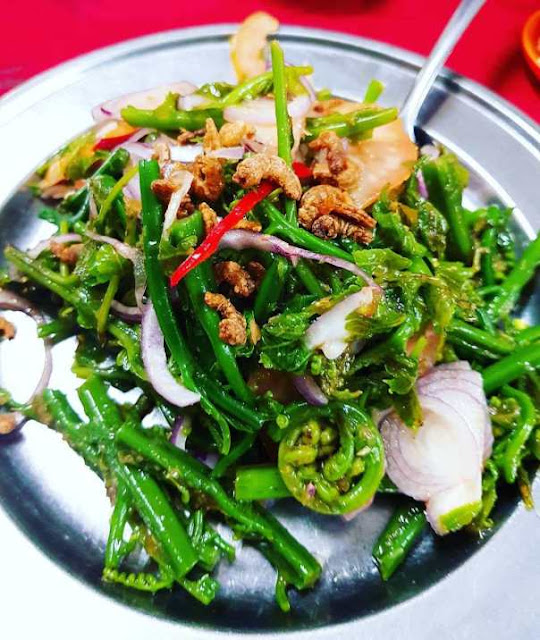
Find the location of `upper rim of bowl`. upper rim of bowl is located at coordinates (525, 128).